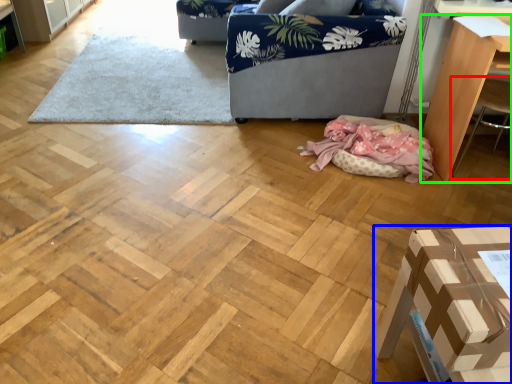
Question: Estimate the real-world distances between objects in this image. Which object is closer to armchair (highlighted by a red box), furniture (highlighted by a blue box) or furniture (highlighted by a green box)?

Choices:
 (A) furniture
 (B) furniture

Answer: (B)